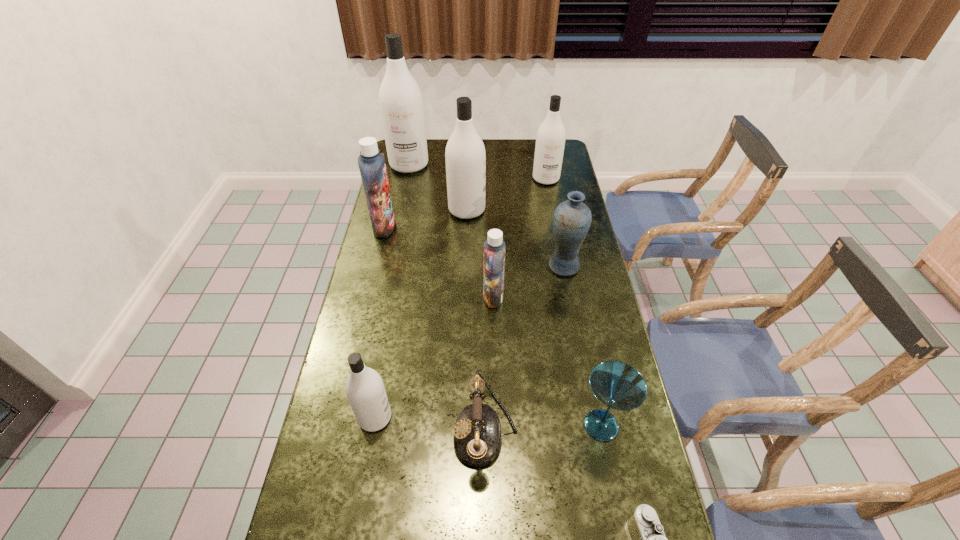
This screenshot has height=540, width=960. In order to click on empty location between the second nearest shampoo and the third biggest white shampoo in this screenshot , I will do `click(519, 238)`.

The width and height of the screenshot is (960, 540). I want to click on free space that is in between the telephone and the smallest white shampoo, so click(x=430, y=424).

Find the location of `free spot between the tallest object and the bigger blue shampoo`. free spot between the tallest object and the bigger blue shampoo is located at coordinates (396, 196).

The height and width of the screenshot is (540, 960). In order to click on vacant space that's between the telephone and the left blue shampoo in this screenshot , I will do `click(435, 328)`.

Find the location of `the fifth closest object to the blue vase`. the fifth closest object to the blue vase is located at coordinates (617, 385).

Where is `object that can be found as the fourth closest to the second nearest white shampoo`? The height and width of the screenshot is (540, 960). object that can be found as the fourth closest to the second nearest white shampoo is located at coordinates (571, 222).

Where is `shampoo that can be found as the sixth closest to the black telephone`? This screenshot has width=960, height=540. shampoo that can be found as the sixth closest to the black telephone is located at coordinates tap(401, 105).

Identify the location of the closest shampoo to the biggest white shampoo. (465, 155).

Locate an element on the screen. white shampoo object that ranks as the closest to the vase is located at coordinates (465, 155).

I want to click on the second closest white shampoo to the second white shampoo from right to left, so click(x=550, y=141).